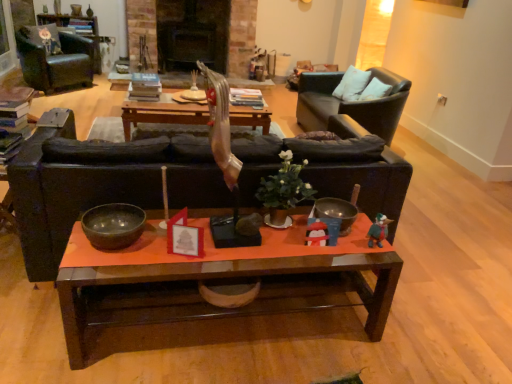
This screenshot has width=512, height=384. Find the location of `blank space situated above shiny brown wooden coffee table at center, which appears as the 2th coffee table when viewed from the back (from a real-world perspective)`. blank space situated above shiny brown wooden coffee table at center, which appears as the 2th coffee table when viewed from the back (from a real-world perspective) is located at coordinates (248, 240).